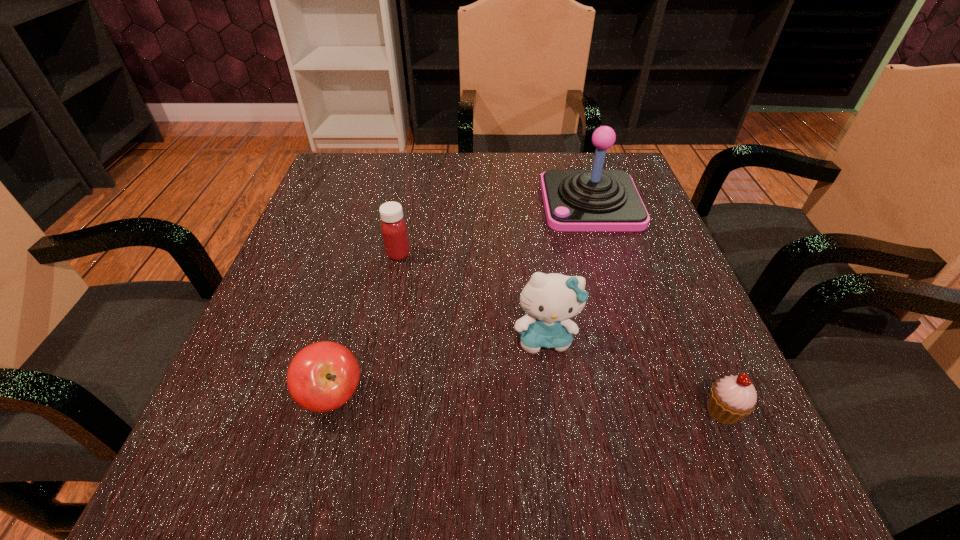
Where is `vacant space that satisfies the following two spatial constraints: 1. on the front side of the medicine; 2. on the left side of the cupcake`? This screenshot has height=540, width=960. vacant space that satisfies the following two spatial constraints: 1. on the front side of the medicine; 2. on the left side of the cupcake is located at coordinates (367, 411).

Where is `free space that satisfies the following two spatial constraints: 1. forward from the base of the joystick; 2. on the right side of the cupcake`? Image resolution: width=960 pixels, height=540 pixels. free space that satisfies the following two spatial constraints: 1. forward from the base of the joystick; 2. on the right side of the cupcake is located at coordinates (657, 411).

Where is `vacant space that satisfies the following two spatial constraints: 1. forward from the base of the farthest object; 2. on the back side of the cupcake`? This screenshot has width=960, height=540. vacant space that satisfies the following two spatial constraints: 1. forward from the base of the farthest object; 2. on the back side of the cupcake is located at coordinates (657, 411).

Identify the location of free location that satisfies the following two spatial constraints: 1. on the front side of the fourth nearest object; 2. on the right side of the cupcake. This screenshot has width=960, height=540. (367, 411).